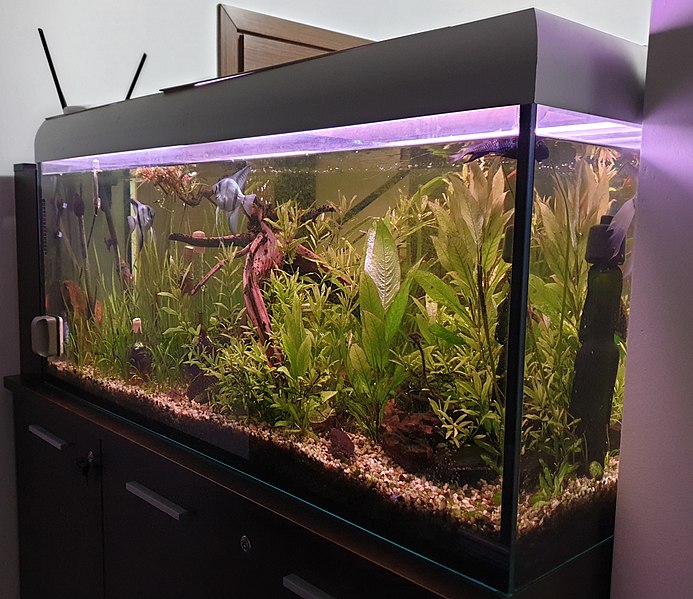
Identify the location of fishtank. This screenshot has width=693, height=599. (315, 108).